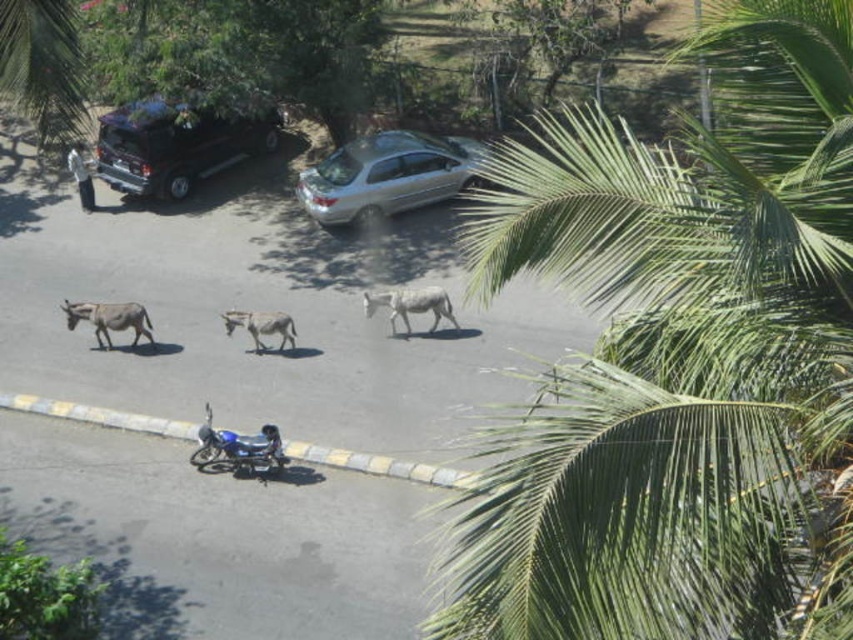
Between silver metallic sedan at center and metallic blue motorcycle at upper left, which one has less height?

Standing shorter between the two is metallic blue motorcycle at upper left.

Is point (311, 205) farther from camera compared to point (74, 154)?

No, it is in front of (74, 154).

Find the location of a particular element. Image resolution: width=853 pixels, height=640 pixels. silver metallic sedan at center is located at coordinates (386, 176).

Is blue metallic motorcycle at lower center to the left of white matte donkey at center from the viewer's perspective?

Yes, blue metallic motorcycle at lower center is to the left of white matte donkey at center.

Between point (280, 461) and point (364, 314), which one is positioned behind?

Positioned behind is point (364, 314).

This screenshot has height=640, width=853. What do you see at coordinates (239, 449) in the screenshot?
I see `blue metallic motorcycle at lower center` at bounding box center [239, 449].

I want to click on blue metallic motorcycle at lower center, so click(x=239, y=449).

Is blue metallic motorcycle at lower center positioned in front of white matte goat at center?

Yes.

Looking at this image, does blue metallic motorcycle at lower center have a greater width compared to white matte goat at center?

Yes.

Locate an element on the screen. The height and width of the screenshot is (640, 853). blue metallic motorcycle at lower center is located at coordinates (239, 449).